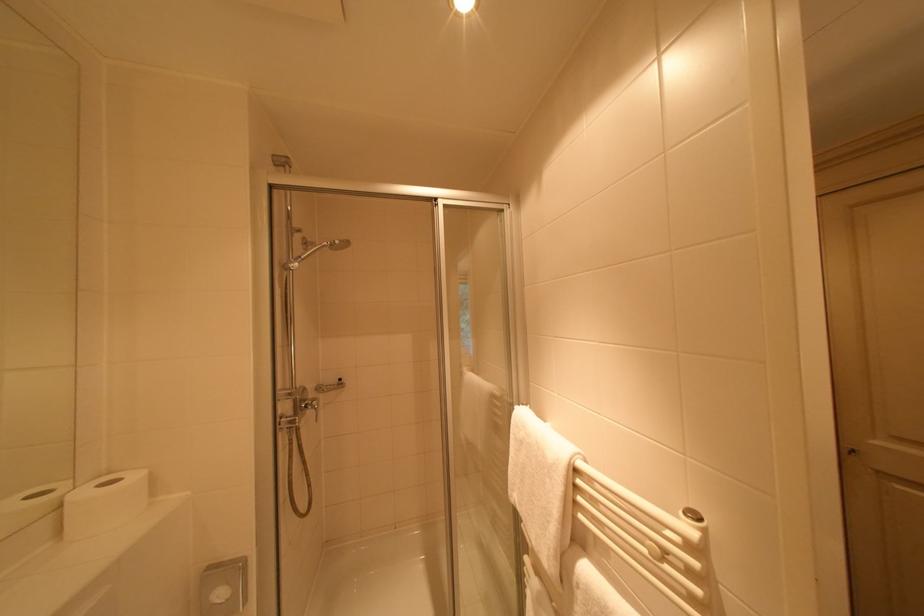
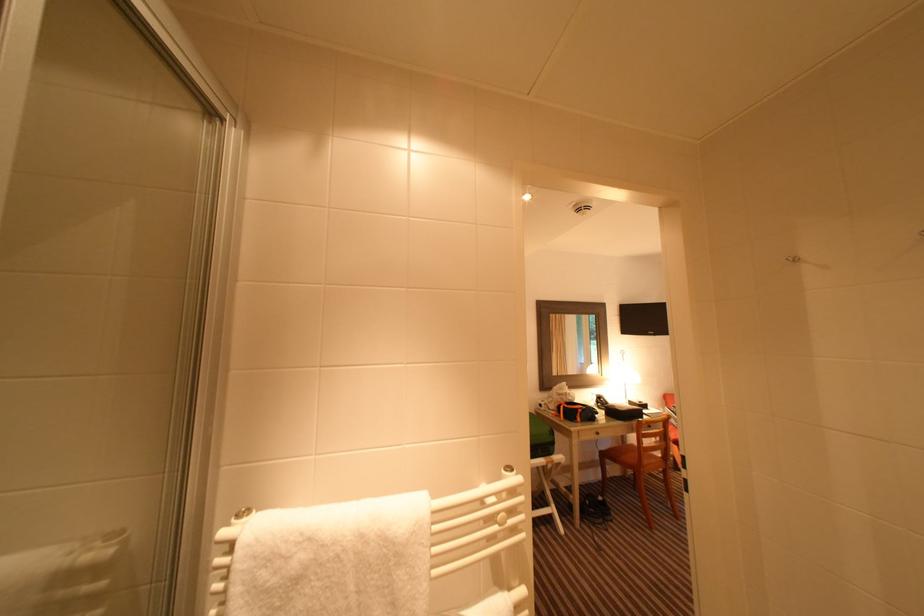
Question: Based on the continuous images, in which direction is the camera rotating? Reply with the corresponding letter.

Choices:
 (A) Left
 (B) Right
 (C) Up
 (D) Down

Answer: (B)